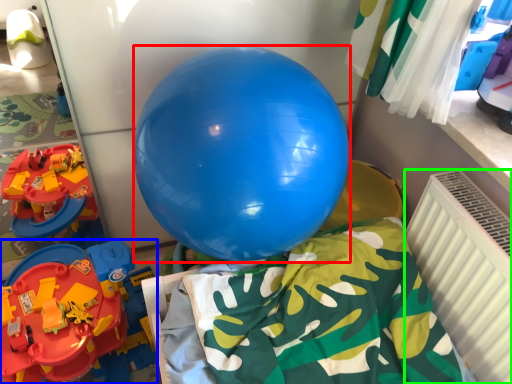
Question: Considering the real-world distances, which object is closest to balloon (highlighted by a red box)? toy (highlighted by a blue box) or radiator (highlighted by a green box).

Choices:
 (A) toy
 (B) radiator

Answer: (B)